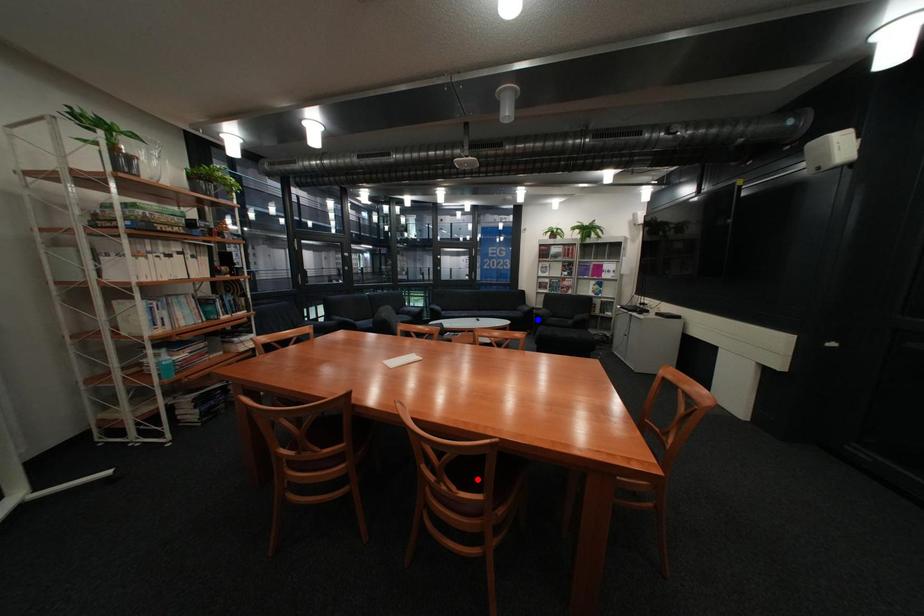
Question: Which of the two points in the image is closer to the camera?

Choices:
 (A) Blue point is closer.
 (B) Red point is closer.

Answer: (B)